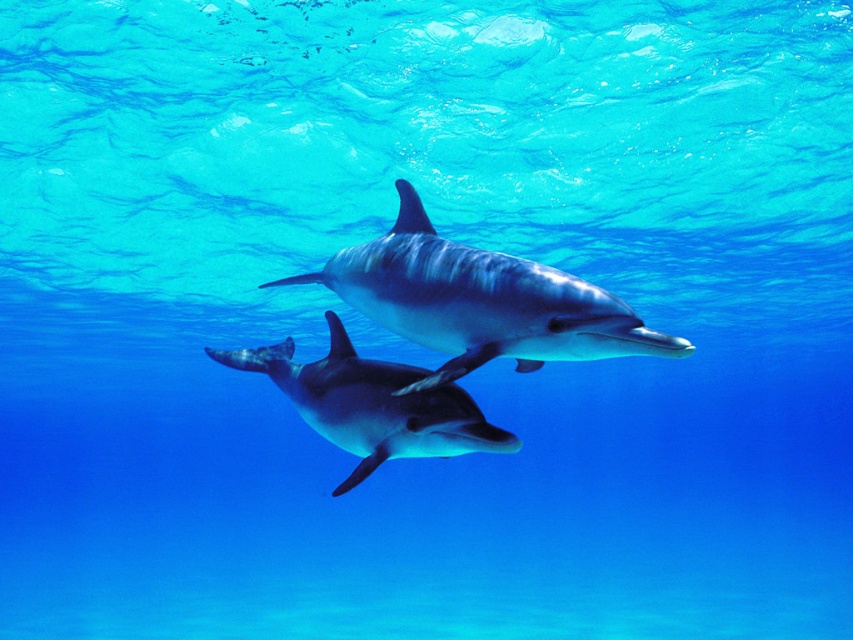
Does smooth gray dolphin at center have a lesser width compared to glossy blue dolphin at center?

No, smooth gray dolphin at center is not thinner than glossy blue dolphin at center.

Which is in front, point (399, 292) or point (424, 436)?

Point (424, 436)

This screenshot has width=853, height=640. What do you see at coordinates (479, 301) in the screenshot? I see `smooth gray dolphin at center` at bounding box center [479, 301].

Find the location of a particular element. The image size is (853, 640). smooth gray dolphin at center is located at coordinates (479, 301).